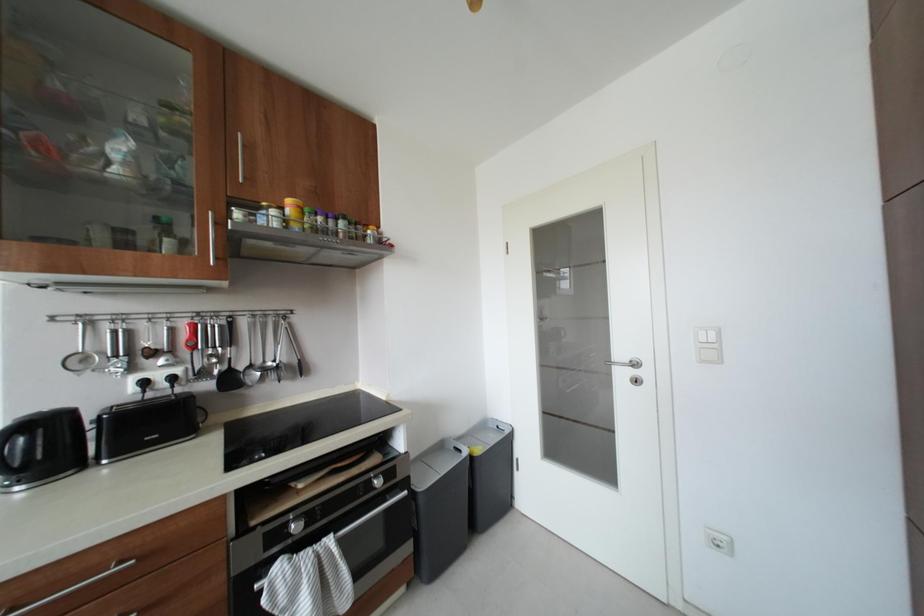
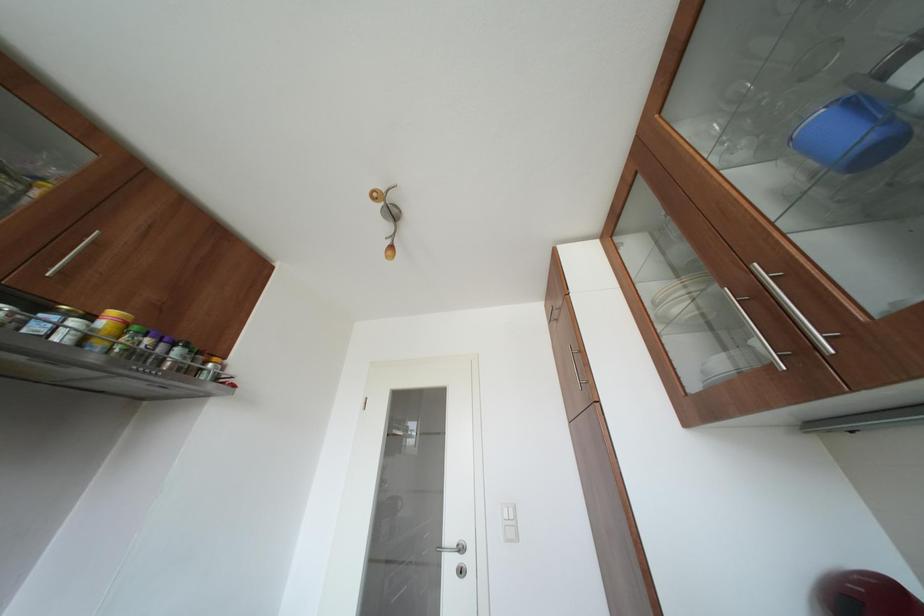
The images are taken continuously from a first-person perspective. In which direction is your viewpoint rotating?

The camera's rotation is toward right-up.